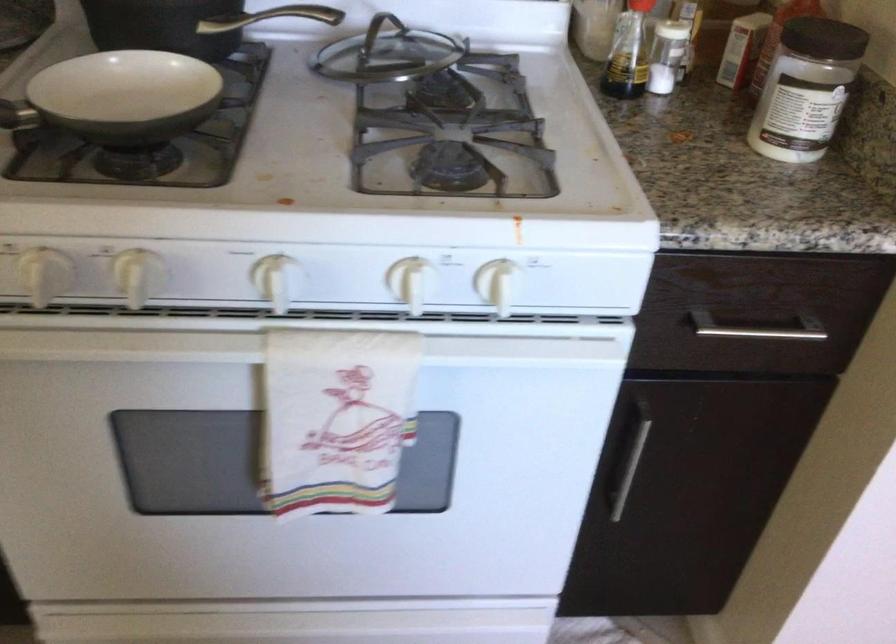
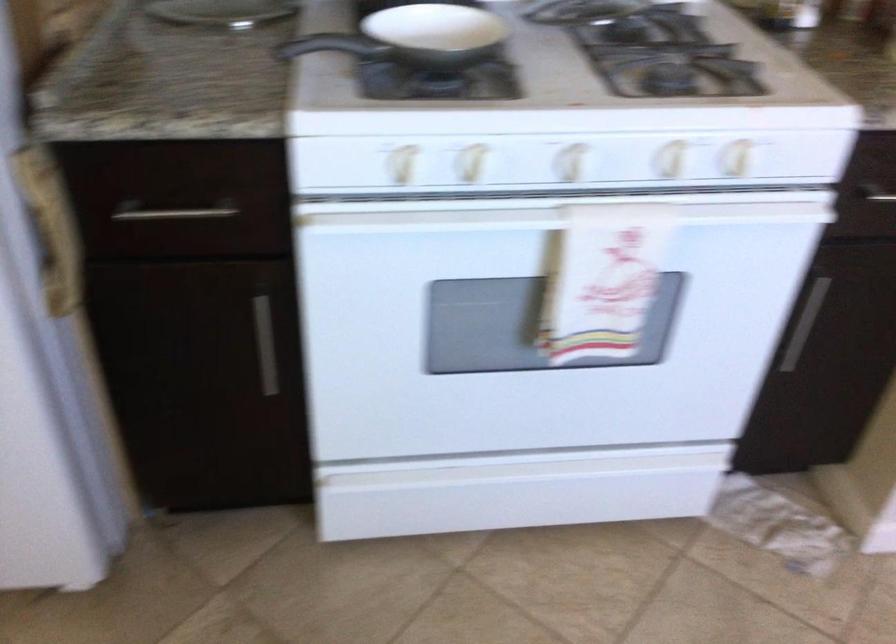
Where in the second image is the point corresponding to point 162,90 from the first image?

(436, 33)